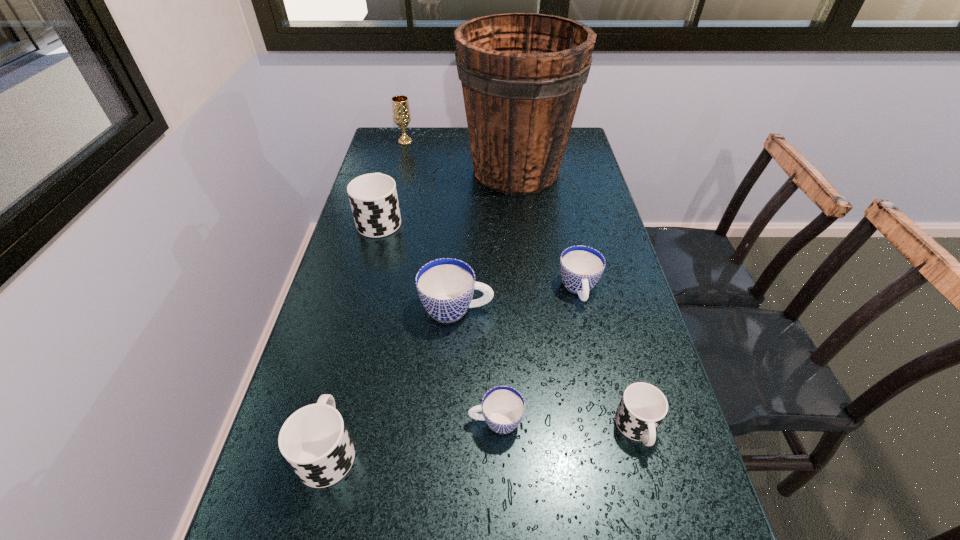
I want to click on vacant area at the far edge, so click(453, 127).

The width and height of the screenshot is (960, 540). Find the location of `vacant space at the left edge`. vacant space at the left edge is located at coordinates (310, 395).

This screenshot has width=960, height=540. In the image, there is a desktop. In order to click on vacant space at the right edge in this screenshot , I will do `click(635, 467)`.

Find the location of `vacant region at the far left corner`. vacant region at the far left corner is located at coordinates (402, 155).

Where is `unoccupied area between the second biggest black cup and the tallest object`? The image size is (960, 540). unoccupied area between the second biggest black cup and the tallest object is located at coordinates (422, 310).

Locate an element on the screen. The image size is (960, 540). free space between the smallest black cup and the third tallest object is located at coordinates (509, 324).

This screenshot has height=540, width=960. In order to click on free space that is in between the biggest blue cup and the bucket in this screenshot , I will do `click(487, 240)`.

The height and width of the screenshot is (540, 960). I want to click on blank region between the seventh shortest object and the rightmost blue cup, so click(x=492, y=215).

Find the location of `empty space that is in between the smallest blue cup and the smallest black cup`. empty space that is in between the smallest blue cup and the smallest black cup is located at coordinates (566, 425).

You are a GUI agent. You are given a task and a screenshot of the screen. Output one action in this format:
    pyautogui.click(x=<x>, y=<y>)
    Task: Click on the free point between the biggest blue cup and the second biggest blue cup
    The image size is (960, 540).
    Given the screenshot: What is the action you would take?
    pyautogui.click(x=517, y=299)